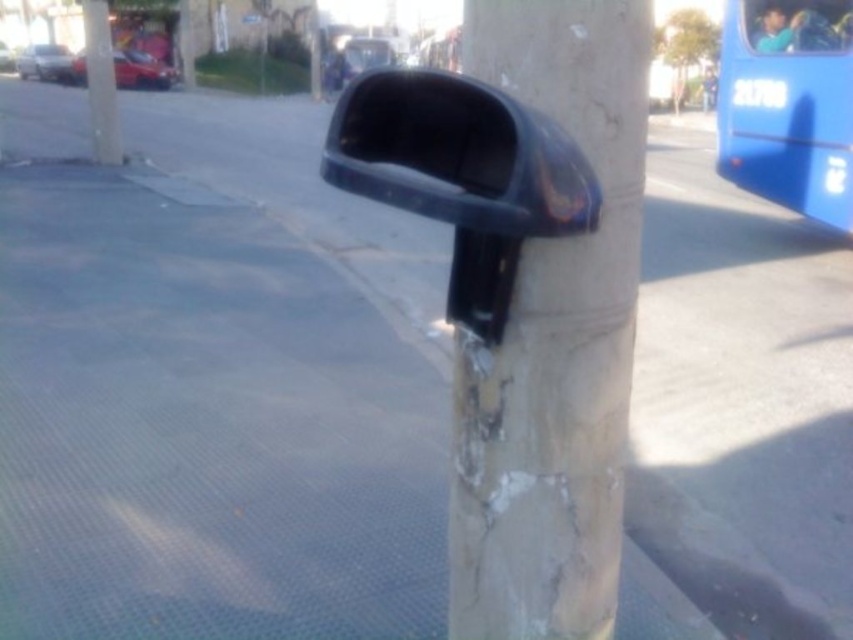
Question: Estimate the real-world distances between objects in this image. Which object is farther from the smooth concrete pole at upper center?

Choices:
 (A) blue matte bus at upper right
 (B) black plastic view mirror at center
 (C) marbled stone pole at center

Answer: (C)

Question: Among these points, which one is nearest to the camera?

Choices:
 (A) (563, 628)
 (B) (85, 17)
 (C) (840, 72)
 (D) (554, 188)

Answer: (D)

Question: Does black plastic view mirror at center have a larger size compared to blue matte bus at upper right?

Choices:
 (A) no
 (B) yes

Answer: (A)

Question: Which object is positioned farthest from the marbled stone pole at center?

Choices:
 (A) black plastic view mirror at center
 (B) smooth concrete pole at upper center
 (C) blue matte bus at upper right

Answer: (B)

Question: Where is marbled stone pole at center located in relation to blue matte bus at upper right in the image?

Choices:
 (A) below
 (B) above

Answer: (A)

Question: Can you confirm if marbled stone pole at center is positioned above black plastic view mirror at center?

Choices:
 (A) no
 (B) yes

Answer: (A)